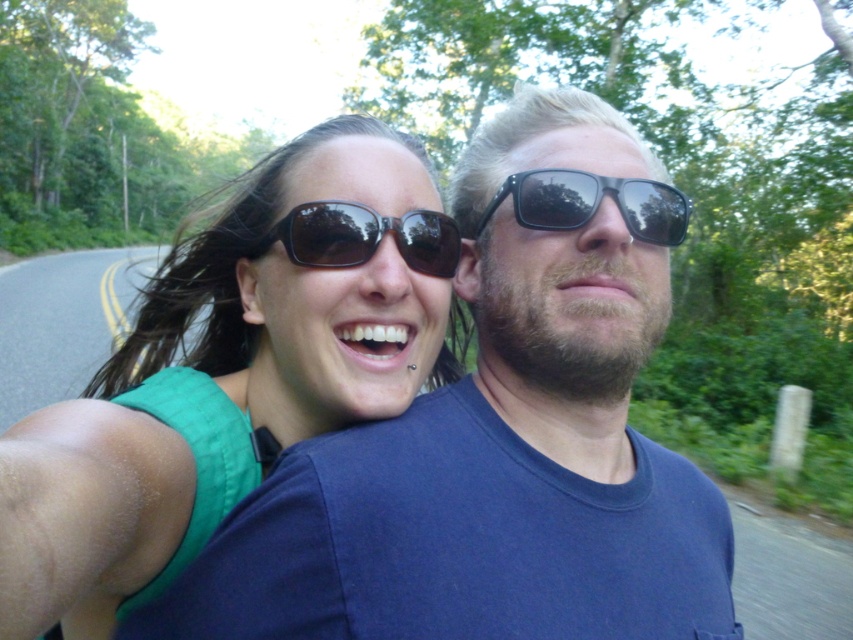
Does green fabric top at upper left come behind black reflective sunglasses at upper center?

No, it is not.

Which is more to the right, green fabric top at upper left or black reflective sunglasses at upper center?

Positioned to the right is black reflective sunglasses at upper center.

Where is `green fabric top at upper left`? This screenshot has width=853, height=640. green fabric top at upper left is located at coordinates (231, 371).

Does point (618, 168) come closer to viewer compared to point (549, 182)?

No, (618, 168) is behind (549, 182).

The width and height of the screenshot is (853, 640). What are the coordinates of `blue matte shirt at center` in the screenshot? It's located at (498, 438).

Is point (601, 164) positioned before point (252, 209)?

Yes.

Who is shorter, blue matte shirt at center or green fabric top at upper left?

Standing shorter between the two is green fabric top at upper left.

Locate an element on the screen. The width and height of the screenshot is (853, 640). blue matte shirt at center is located at coordinates (498, 438).